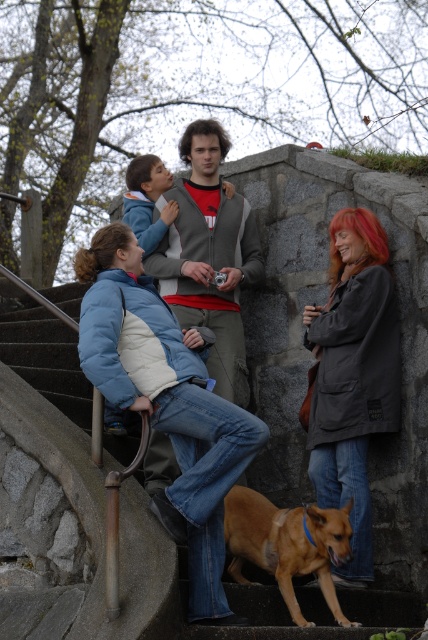
You are standing at the origin point of the image. Which object is closer to the top edge of the image, the blue denim jacket at left or the gray vest over red shirt and khaki pants?

The blue denim jacket at left is located at point (x=166, y=400), which is closer to the top edge of the image compared to the gray vest over red shirt and khaki pants. Therefore, the blue denim jacket at left is closer to the top edge.

You are a photographer trying to capture a candid shot of the group. You notice two gray items at the center of the scene. Which one is closer to the camera? The two items are the matte gray coat at center and the gray fleece jacket at center.

The matte gray coat at center is in front of the gray fleece jacket at center, so the matte gray coat at center is closer to the camera.